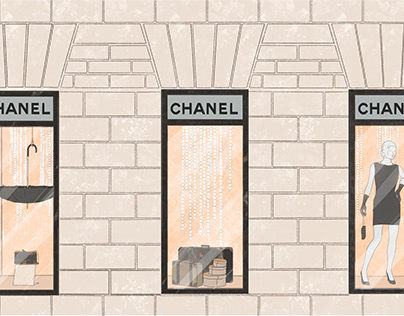
Find the location of `bottom of window`. bottom of window is located at coordinates (211, 299).